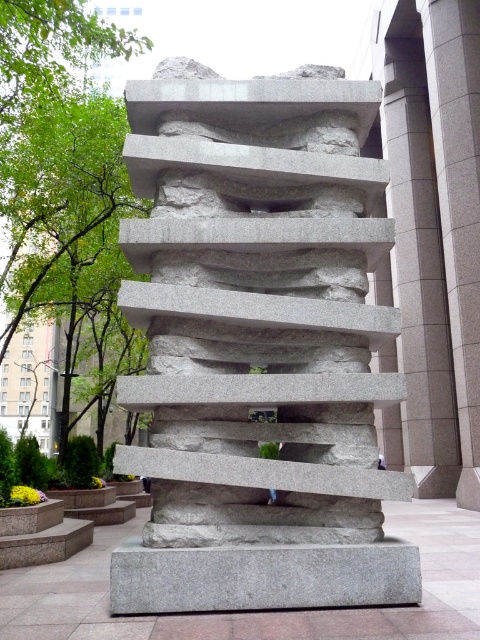
At what (x,y) coordinates should I click in order to perform the action: click on gray granite sculpture at center. Please return your answer as a coordinate pair (x, y). Looking at the image, I should click on (257, 346).

Is gray granite sculpture at center positioned before gray granite base at center?

That is False.

Where is `gray granite sculpture at center`? gray granite sculpture at center is located at coordinates (257, 346).